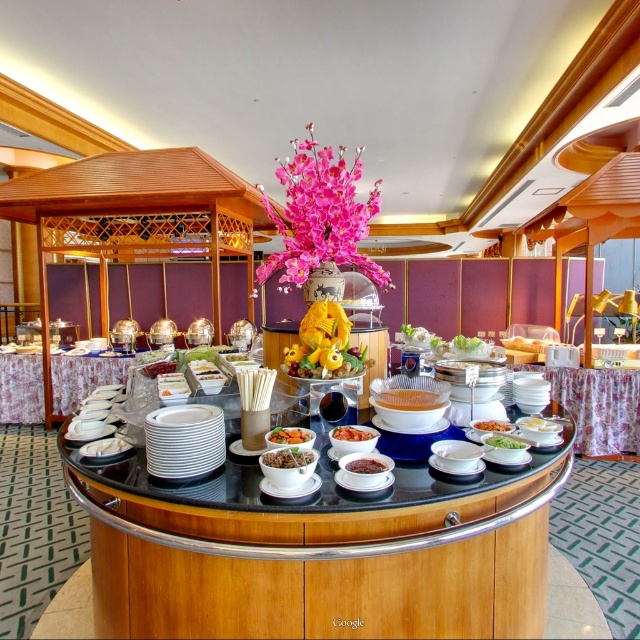
You are a guest at the buffet and want to serve yourself the slightly browned rice at center. The white glossy bowl at center is in your way. Can you reach the rice without moving the bowl?

The slightly browned rice at center is below the white glossy bowl at center, so you can reach it without moving the bowl.

You are a server at the buffet and need to place a new dish between the slightly browned rice at center and the white glossy bowl at center. The dish is 1.2 meters long. Will it fit between them?

The distance between the slightly browned rice at center and the white glossy bowl at center is 1.08 meters. Since the dish is 1.2 meters long, which is longer than the available space, it will not fit between them.